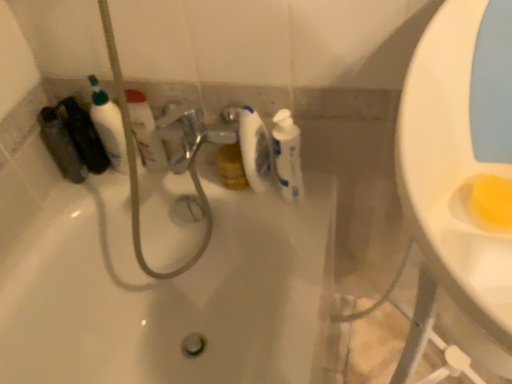
I want to click on blank space to the left of white glossy toilet paper at center, so click(x=208, y=177).